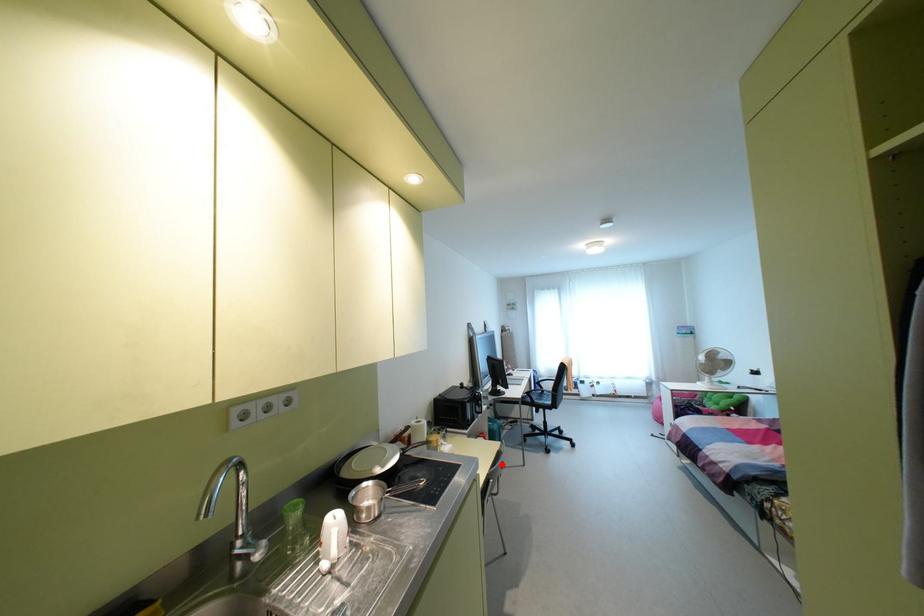
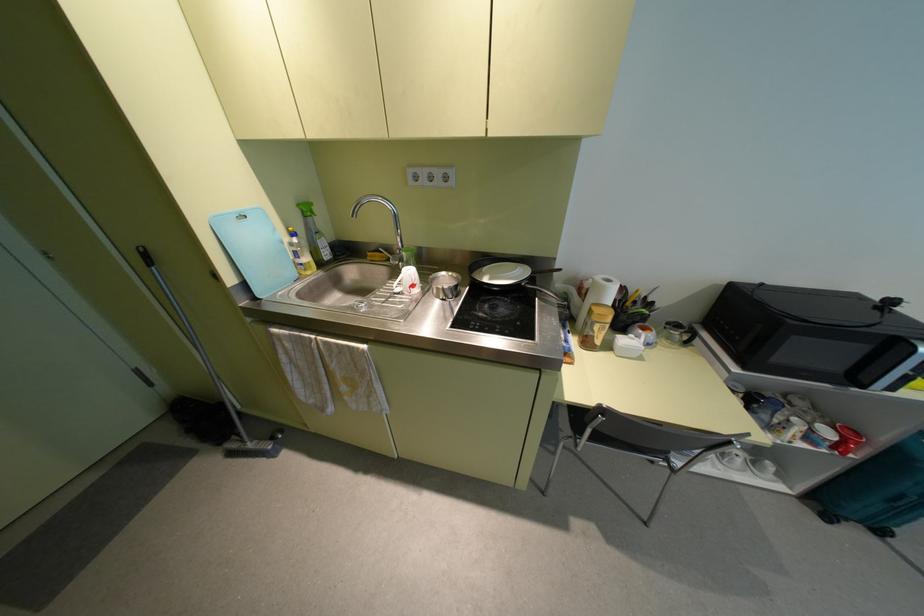
Question: I am providing you with two images of the same scene from different viewpoints. A red point is marked on the first image. At the location where the point appears in image 1, is it still visible in image 2?

Choices:
 (A) Yes
 (B) No

Answer: (A)